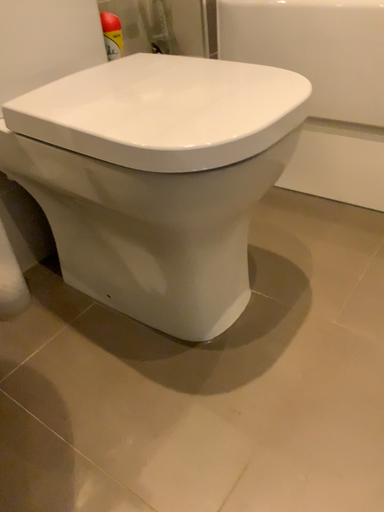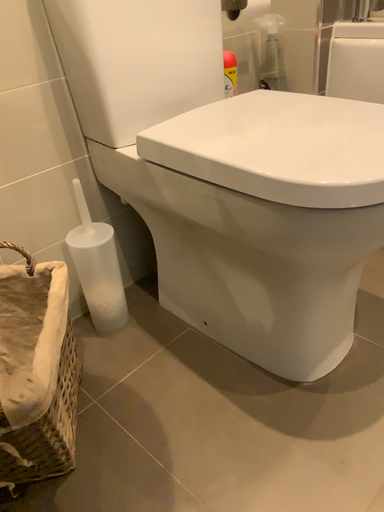
Question: How did the camera likely rotate when shooting the video?

Choices:
 (A) rotated right
 (B) rotated left

Answer: (B)